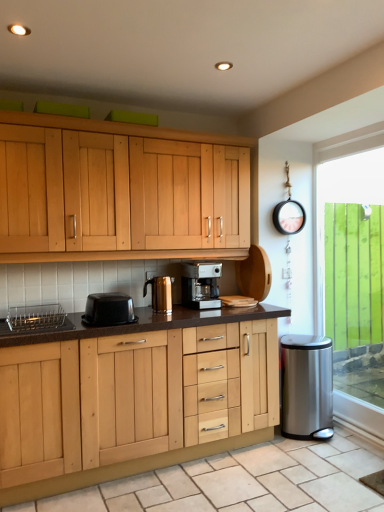
The width and height of the screenshot is (384, 512). I want to click on vacant space in front of stainless steel trash can at right, marked as the 1th appliance in a back-to-front arrangement, so click(331, 454).